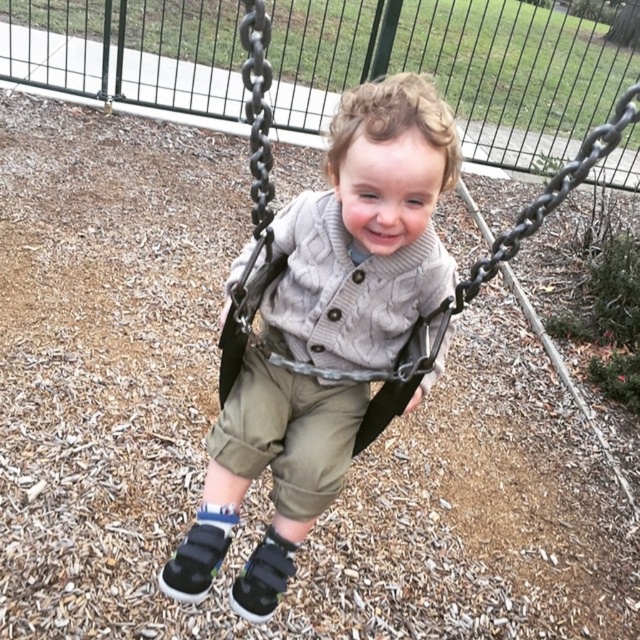
Question: Which point is farther to the camera?

Choices:
 (A) khaki cotton pants at center
 (B) gray fabric swing at center

Answer: (A)

Question: From the image, what is the correct spatial relationship of gray fabric swing at center in relation to khaki cotton pants at center?

Choices:
 (A) left
 (B) right

Answer: (B)

Question: Is knitted sweater at center wider than khaki cotton pants at center?

Choices:
 (A) no
 (B) yes

Answer: (B)

Question: Is knitted sweater at center smaller than khaki cotton pants at center?

Choices:
 (A) yes
 (B) no

Answer: (B)

Question: Which is farther from the gray fabric swing at center?

Choices:
 (A) khaki cotton pants at center
 (B) knitted sweater at center

Answer: (B)

Question: Which object appears closest to the camera in this image?

Choices:
 (A) gray fabric swing at center
 (B) khaki cotton pants at center

Answer: (A)